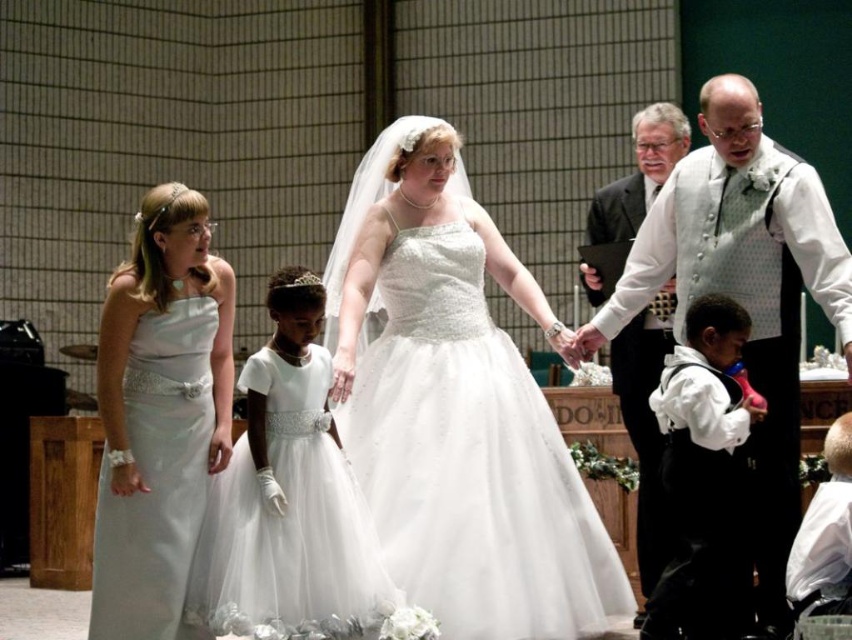
Between white satin dress at center and white dotted vest at center, which one has less height?

Standing shorter between the two is white satin dress at center.

Does white satin dress at center appear under white dotted vest at center?

Correct, white satin dress at center is located below white dotted vest at center.

Between point (540, 621) and point (672, 268), which one is positioned behind?

Point (672, 268)

Find the location of a particular element. white satin dress at center is located at coordinates (456, 406).

Is white tulle dress at center to the left of satin white dress at left from the viewer's perspective?

Incorrect, white tulle dress at center is not on the left side of satin white dress at left.

Which is more to the left, white tulle dress at center or satin white dress at left?

From the viewer's perspective, satin white dress at left appears more on the left side.

Between point (205, 529) and point (125, 616), which one is positioned in front?

Point (125, 616) is more forward.

The height and width of the screenshot is (640, 852). What are the coordinates of `white tulle dress at center` in the screenshot? It's located at (289, 522).

Does white satin dress at center appear over black satin vest at right?

Yes.

The image size is (852, 640). What do you see at coordinates (456, 406) in the screenshot?
I see `white satin dress at center` at bounding box center [456, 406].

Locate an element on the screen. This screenshot has height=640, width=852. white satin dress at center is located at coordinates (456, 406).